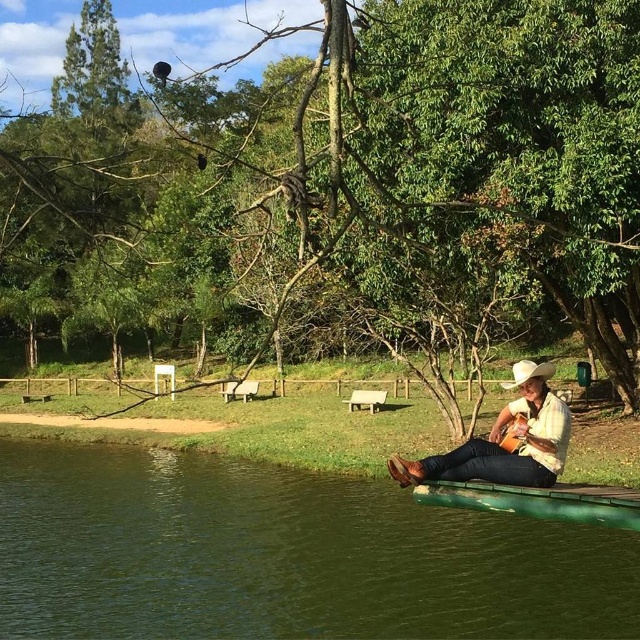
Question: Which point is farther to the camera?

Choices:
 (A) (538, 433)
 (B) (490, 486)
 (C) (467, 588)

Answer: (C)

Question: Does leather cowboy hat at center lie in front of green rubber canoe at lower center?

Choices:
 (A) yes
 (B) no

Answer: (B)

Question: Does green rubber raft at lower right have a smaller size compared to green rubber canoe at lower center?

Choices:
 (A) no
 (B) yes

Answer: (A)

Question: Which point is farther to the camera?

Choices:
 (A) leather cowboy hat at center
 (B) green rubber canoe at lower center
 (C) green rubber raft at lower right

Answer: (A)

Question: Which is nearer to the green rubber raft at lower right?

Choices:
 (A) green rubber canoe at lower center
 (B) leather cowboy hat at center

Answer: (A)

Question: Does green rubber raft at lower right appear on the right side of leather cowboy hat at center?

Choices:
 (A) no
 (B) yes

Answer: (A)